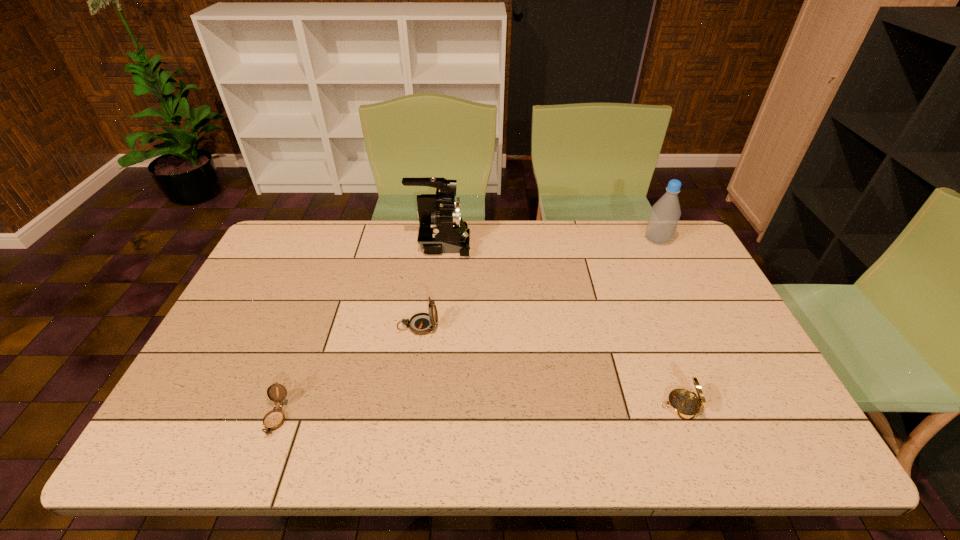
Identify the location of vacant area situated on the face of the third shortest object. Image resolution: width=960 pixels, height=540 pixels. (460, 326).

Where is `free location located with the dial facing the fourth tallest object`? free location located with the dial facing the fourth tallest object is located at coordinates (585, 406).

The image size is (960, 540). What are the coordinates of `vacant space located with the dial facing the fourth tallest object` in the screenshot? It's located at (602, 406).

Where is `free region located 0.260m with the dial facing the fourth tallest object`? This screenshot has width=960, height=540. free region located 0.260m with the dial facing the fourth tallest object is located at coordinates (551, 406).

Find the location of a particular element. camcorder positioned at the far edge is located at coordinates (442, 230).

Where is `bottle that is at the far edge`? bottle that is at the far edge is located at coordinates (x=664, y=216).

The image size is (960, 540). Identify the location of object positioned at the near edge. (274, 419).

Identify the location of object that is at the right edge. This screenshot has width=960, height=540. (664, 216).

The width and height of the screenshot is (960, 540). What are the coordinates of `object at the far right corner` in the screenshot? It's located at (664, 216).

The height and width of the screenshot is (540, 960). Find the location of `free space at the far edge of the desktop`. free space at the far edge of the desktop is located at coordinates (359, 254).